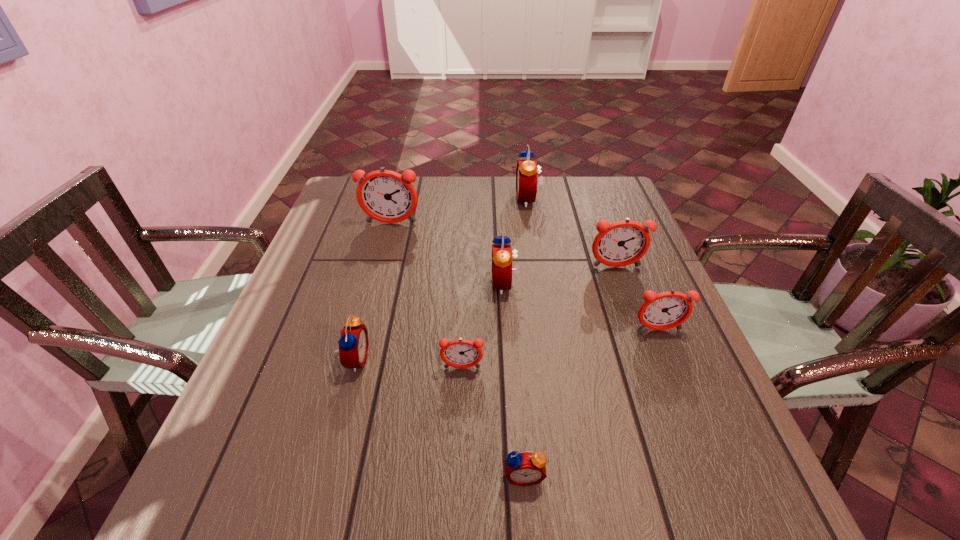
Image resolution: width=960 pixels, height=540 pixels. What are the coordinates of `vacant region located on the front-facing side of the third nearest red alarm clock` in the screenshot? It's located at (387, 284).

This screenshot has width=960, height=540. Identify the location of free space located on the front-facing side of the second farthest reddish-pink alarm clock. (662, 394).

What are the coordinates of `free space located 0.370m on the front-facing side of the third biggest red alarm clock` in the screenshot? It's located at (545, 360).

Identify the location of free space located on the front-facing side of the fourth nearest alarm clock. (674, 368).

Where is `free space located 0.220m on the front-facing side of the nearest reddish-pink alarm clock`? The height and width of the screenshot is (540, 960). free space located 0.220m on the front-facing side of the nearest reddish-pink alarm clock is located at coordinates (458, 481).

At what (x,y) coordinates should I click in order to perform the action: click on object at the far edge. Please return your answer as a coordinate pair (x, y). This screenshot has width=960, height=540. Looking at the image, I should click on (526, 172).

The width and height of the screenshot is (960, 540). In order to click on object that is positioned at the near edge in this screenshot , I will do `click(525, 468)`.

Where is `object that is positioned at the left edge`? object that is positioned at the left edge is located at coordinates (386, 196).

The image size is (960, 540). In order to click on vacant space at the far edge of the desktop in this screenshot , I will do tap(438, 205).

This screenshot has height=540, width=960. In order to click on vacant space at the near edge of the desktop in this screenshot , I will do `click(624, 522)`.